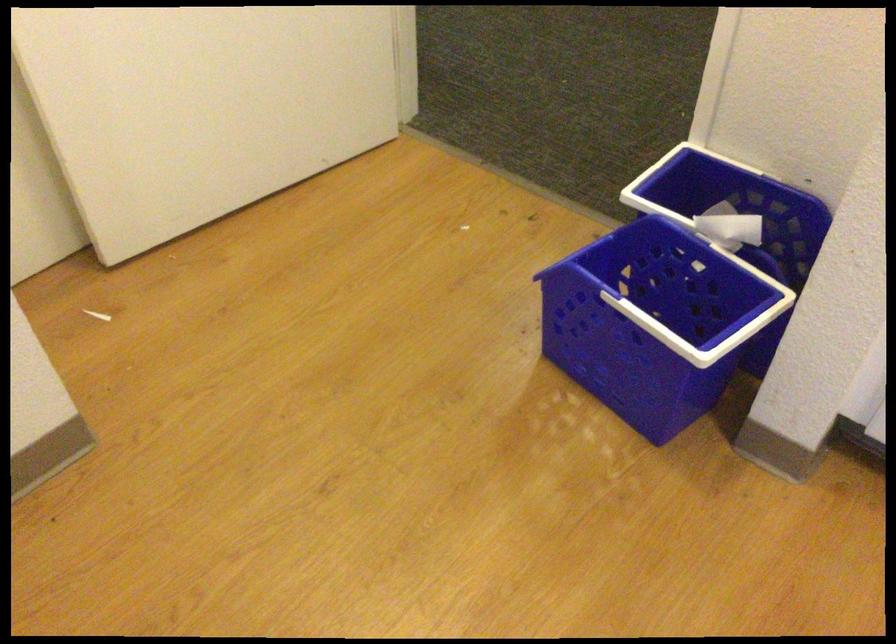
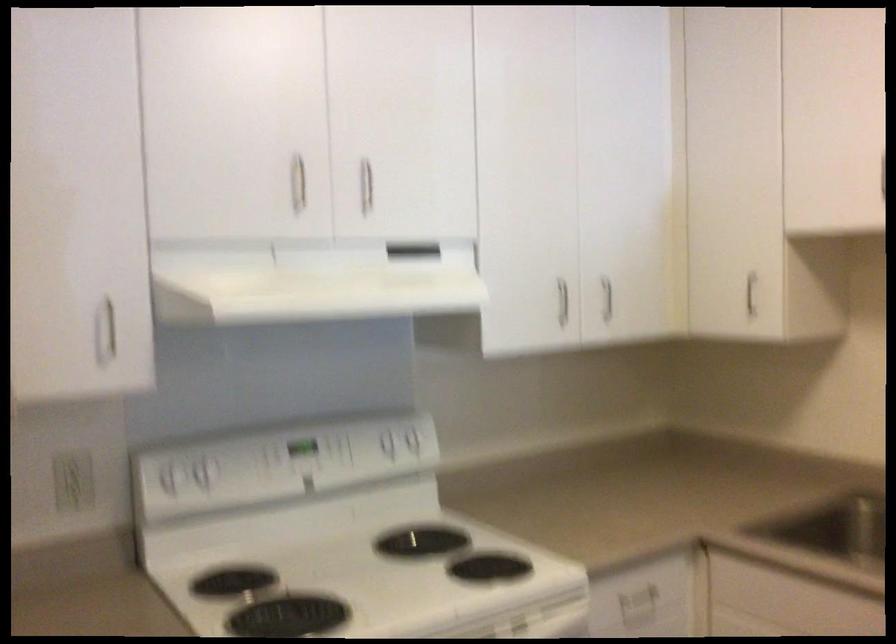
Question: The images are taken continuously from a first-person perspective. In which direction is your viewpoint rotating?

Choices:
 (A) Left
 (B) Right
 (C) Up
 (D) Down

Answer: (B)